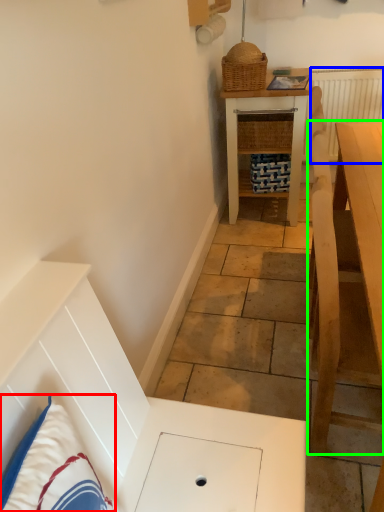
Question: Which is nearer to the pillow (highlighted by a red box)? radiator (highlighted by a blue box) or table (highlighted by a green box).

Choices:
 (A) radiator
 (B) table

Answer: (B)